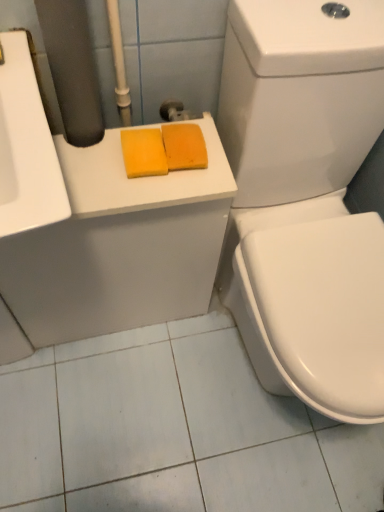
This screenshot has height=512, width=384. Find the location of `blank area to the left of orange sponge at upper center, acting as the second soap starting from the left`. blank area to the left of orange sponge at upper center, acting as the second soap starting from the left is located at coordinates (94, 162).